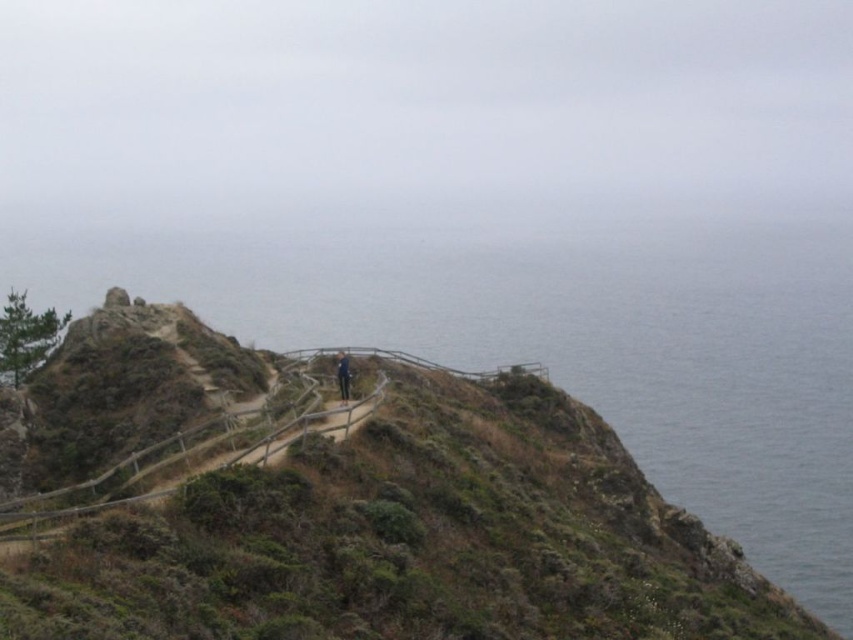
Question: Among these points, which one is farthest from the camera?

Choices:
 (A) (57, 269)
 (B) (341, 369)

Answer: (A)

Question: Which object is farther from the camera taking this photo?

Choices:
 (A) gray water at upper right
 (B) light brown wooden fence at upper center

Answer: (A)

Question: Considering the relative positions of gray water at upper right and light brown wooden fence at upper center in the image provided, where is gray water at upper right located with respect to light brown wooden fence at upper center?

Choices:
 (A) above
 (B) below

Answer: (A)

Question: Does gray water at upper right appear on the right side of light brown wooden fence at upper center?

Choices:
 (A) no
 (B) yes

Answer: (A)

Question: Where is gray water at upper right located in relation to light brown wooden fence at upper center in the image?

Choices:
 (A) below
 (B) above

Answer: (B)